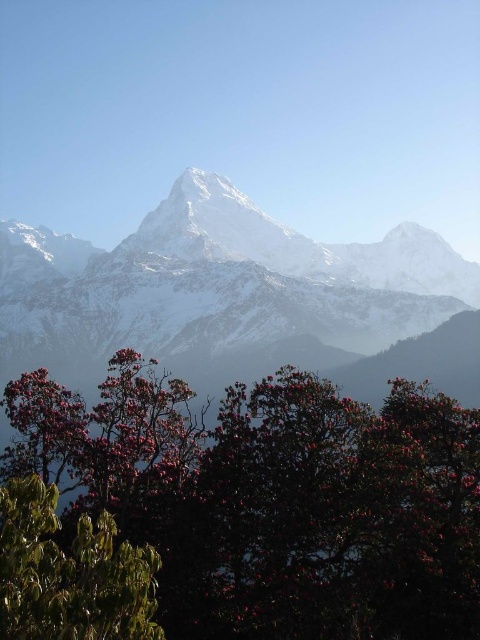
Question: Is white snow-covered mountain range at center wider than green glossy leaves at lower left?

Choices:
 (A) no
 (B) yes

Answer: (B)

Question: Does dark green leafy tree at center have a lesser width compared to white snow-covered mountain range at center?

Choices:
 (A) yes
 (B) no

Answer: (A)

Question: Based on their relative distances, which object is nearer to the dark green leafy tree at center?

Choices:
 (A) white snow-covered mountain range at center
 (B) green glossy leaves at lower left

Answer: (B)

Question: Which point is farther from the camera taking this photo?

Choices:
 (A) (338, 252)
 (B) (156, 516)
 (C) (58, 557)

Answer: (A)

Question: Which point is farther from the camera taking this photo?

Choices:
 (A) (320, 456)
 (B) (292, 348)

Answer: (B)

Question: Is white snow-covered mountain range at center thinner than green glossy leaves at lower left?

Choices:
 (A) yes
 (B) no

Answer: (B)